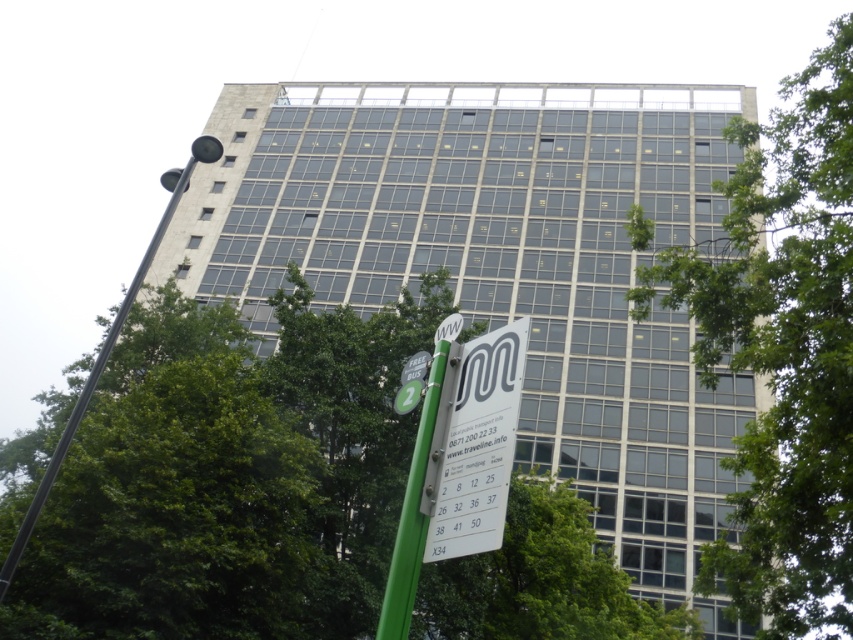
The width and height of the screenshot is (853, 640). Describe the element at coordinates (474, 444) in the screenshot. I see `white plastic sign at lower center` at that location.

Does white plastic sign at lower center appear over black metal pole at left?

Actually, white plastic sign at lower center is below black metal pole at left.

Does point (509, 356) lie behind point (167, 204)?

No, it is not.

At what (x,y) coordinates should I click in order to perform the action: click on white plastic sign at lower center. Please return your answer as a coordinate pair (x, y). Looking at the image, I should click on (474, 444).

Does green leafy tree at center come in front of white plastic sign at lower center?

That is False.

Is green leafy tree at center wider than white plastic sign at lower center?

Indeed, green leafy tree at center has a greater width compared to white plastic sign at lower center.

Measure the distance between point (x=637, y=316) and camera.

Point (x=637, y=316) is 7.90 meters from camera.

Locate an element on the screen. Image resolution: width=853 pixels, height=640 pixels. green leafy tree at center is located at coordinates (782, 349).

Measure the distance between green metallic pole at lower center and black metal pole at left.

Result: A distance of 10.72 meters exists between green metallic pole at lower center and black metal pole at left.

Is green metallic pole at lower center taller than black metal pole at left?

No, green metallic pole at lower center is not taller than black metal pole at left.

Image resolution: width=853 pixels, height=640 pixels. Describe the element at coordinates (410, 515) in the screenshot. I see `green metallic pole at lower center` at that location.

This screenshot has height=640, width=853. I want to click on green metallic pole at lower center, so click(410, 515).